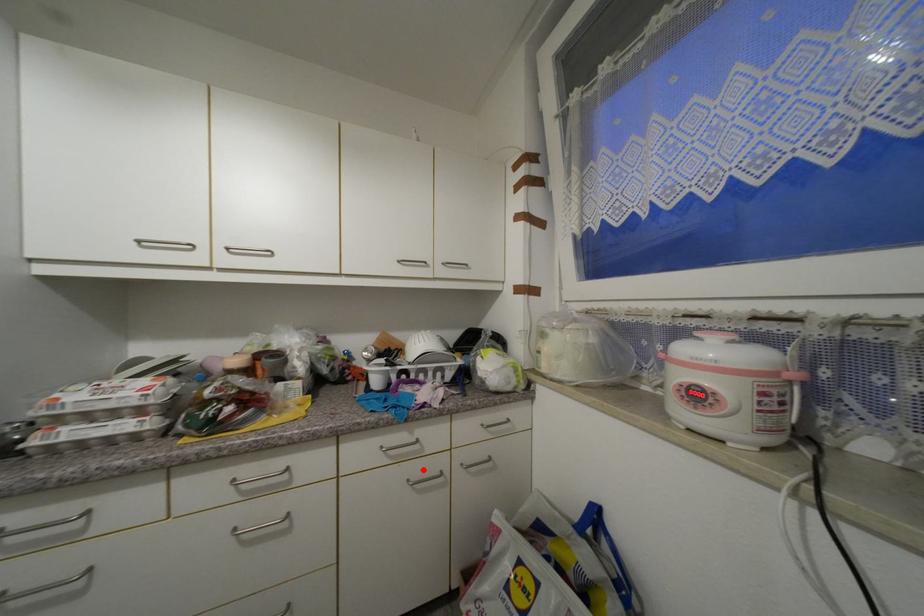
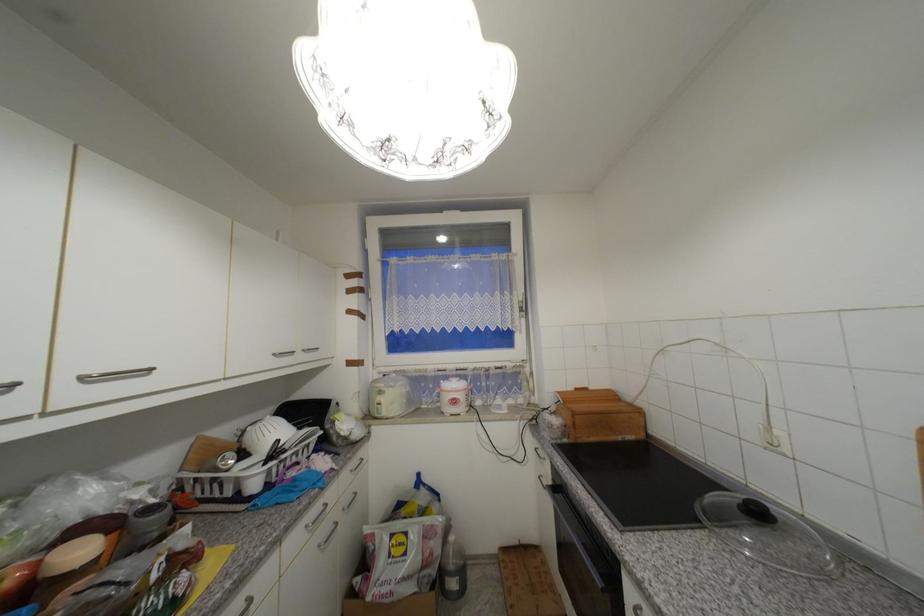
Question: I am providing you with two images of the same scene from different viewpoints. A red point is marked on the first image. At the location where the point appears in image 1, is it still visible in image 2?

Choices:
 (A) Yes
 (B) No

Answer: (A)